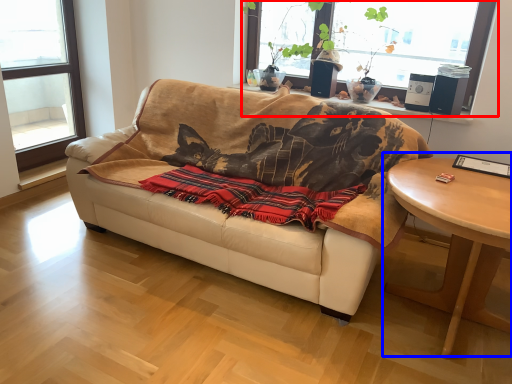
Question: Which of the following is the closest to the observer, window (highlighted by a red box) or coffee table (highlighted by a blue box)?

Choices:
 (A) window
 (B) coffee table

Answer: (B)